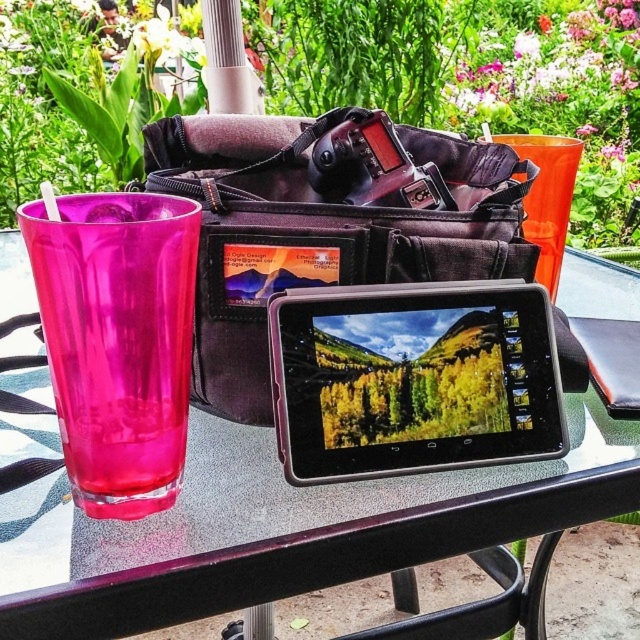
Question: Which object is farther from the camera taking this photo?

Choices:
 (A) matte black bag at center
 (B) transparent plastic cup at left
 (C) transparent glass at upper left

Answer: (A)

Question: Where is transparent glass at upper left located in relation to black plastic tablet at center in the image?

Choices:
 (A) right
 (B) left

Answer: (B)

Question: Which point is farther to the camera?

Choices:
 (A) black plastic tablet at center
 (B) matte black bag at center
 (C) transparent glass at upper left

Answer: (B)

Question: Which object appears farthest from the camera in this image?

Choices:
 (A) transparent plastic cup at left
 (B) transparent glass at upper left
 (C) matte black bag at center
 (D) black plastic tablet at center

Answer: (C)

Question: Is transparent glass at upper left positioned in front of black plastic tablet at center?

Choices:
 (A) yes
 (B) no

Answer: (A)

Question: Observing the image, what is the correct spatial positioning of transparent glass at upper left in reference to matte black bag at center?

Choices:
 (A) left
 (B) right

Answer: (A)